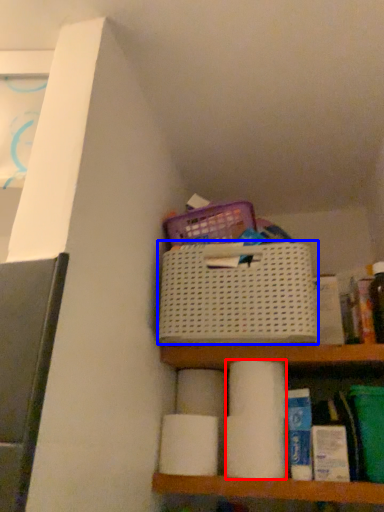
Question: Which object is closer to the camera taking this photo, toilet paper (highlighted by a red box) or basket (highlighted by a blue box)?

Choices:
 (A) toilet paper
 (B) basket

Answer: (B)